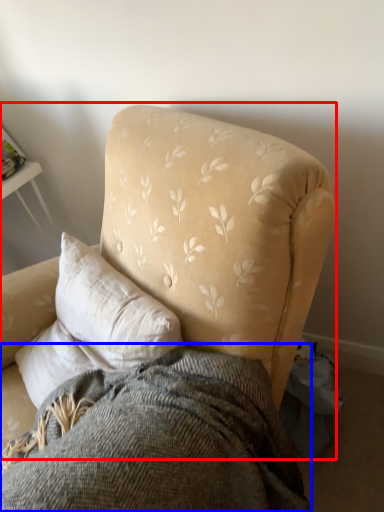
Question: Which object appears closest to the camera in this image, chair (highlighted by a red box) or bedding (highlighted by a blue box)?

Choices:
 (A) chair
 (B) bedding

Answer: (A)